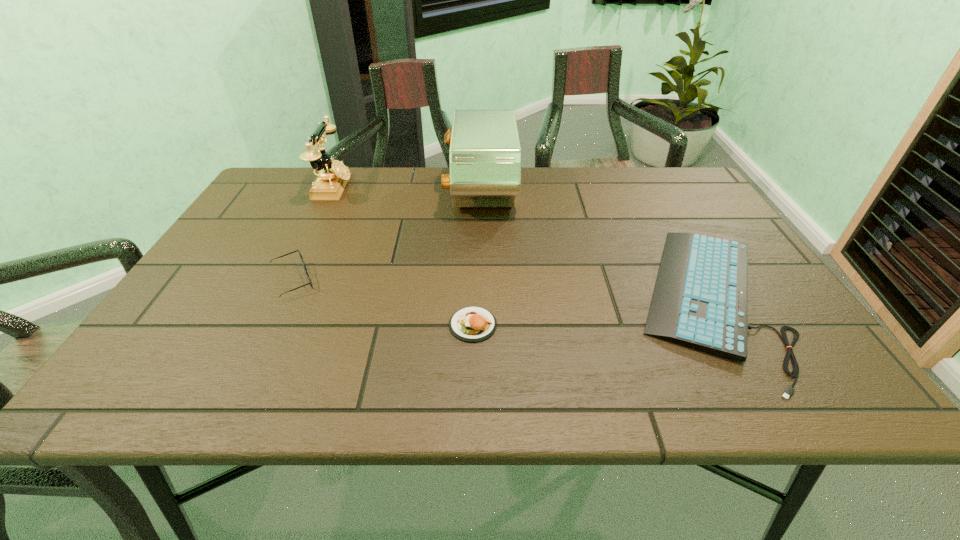
Where is `free space located with the lenses facing outward on the third shortest object`? The image size is (960, 540). free space located with the lenses facing outward on the third shortest object is located at coordinates (383, 281).

Where is `free region located 0.400m on the left of the patty (food)`? This screenshot has height=540, width=960. free region located 0.400m on the left of the patty (food) is located at coordinates (253, 325).

Locate an element on the screen. Image resolution: width=960 pixels, height=540 pixels. vacant space located on the back of the computer keyboard is located at coordinates (642, 185).

Locate an element on the screen. toaster oven located at the far edge is located at coordinates (485, 154).

I want to click on telephone positioned at the far edge, so click(x=333, y=176).

Identify the location of object situated at the near edge. This screenshot has height=540, width=960. (700, 300).

The height and width of the screenshot is (540, 960). Identify the location of object at the right edge. click(700, 300).

This screenshot has width=960, height=540. What are the coordinates of `object at the near right corner` in the screenshot? It's located at (700, 300).

Where is `vacant space at the far edge of the desktop`? The width and height of the screenshot is (960, 540). vacant space at the far edge of the desktop is located at coordinates (577, 201).

Locate an element on the screen. free space at the near edge of the desktop is located at coordinates (495, 377).